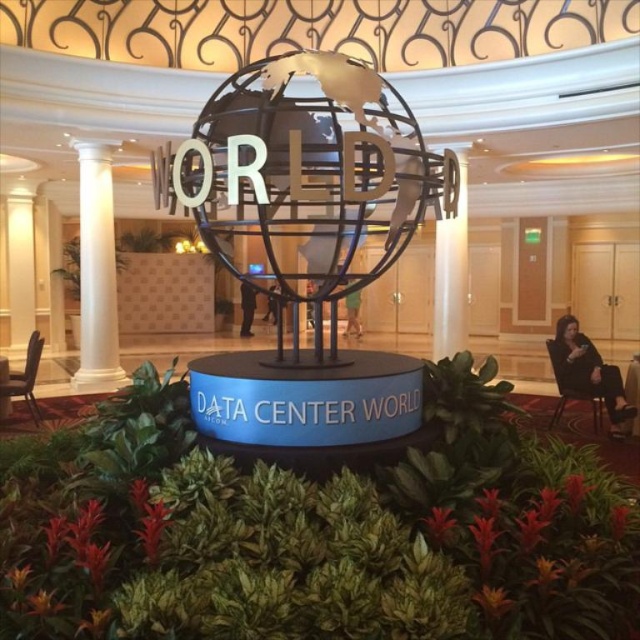
You are planning to place a new decorative item between the white glossy pillar at center and the black fabric chair at right. Given their widths, which object should you consider moving closer to the other to ensure the decorative item fits comfortably between them?

Since the white glossy pillar at center is narrower than the black fabric chair at right, you should move the white glossy pillar at center closer to the black fabric chair at right to create enough space for the decorative item between them.

You are standing in the lobby and want to move from the white marble column at left to the white glossy pillar at center. Which direction should you move to reach the pillar?

You should move to the right because the white marble column at left is to the left of the white glossy pillar at center, so moving right will bring you towards the pillar.

You are planning to move the metallic globe at center and the white marble column at left to a smaller room. Which object might be easier to fit in the smaller room based on their sizes?

The metallic globe at center occupies less space than the white marble column at left, so it would be easier to fit in the smaller room.